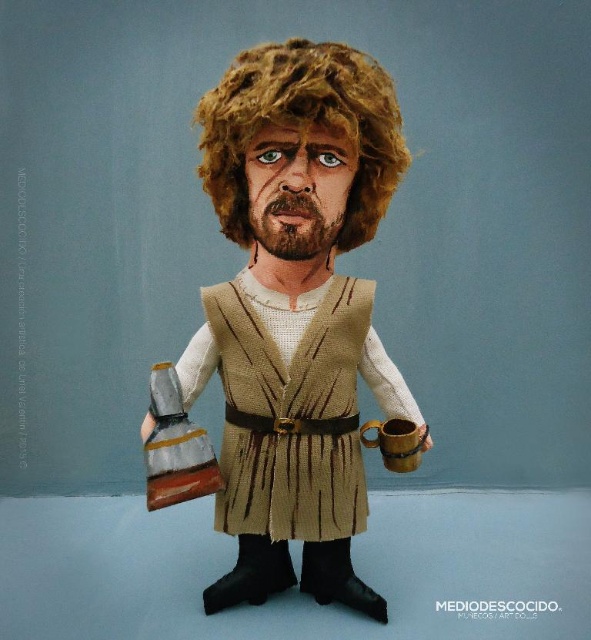
You are an artist trying to draw this fantasy character. You want to ensure the layers of the character are correctly positioned. Which object should appear in front of the other between the matte brown vest at center and the curly blonde wig at upper center?

The matte brown vest at center should appear in front of the curly blonde wig at upper center because it is closer to the viewer.

You are standing in front of the fantasy character figurine. There is a point marked at coordinates (297,310). What object is located at that point?

The point at coordinates (297,310) corresponds to the matte brown vest at center.